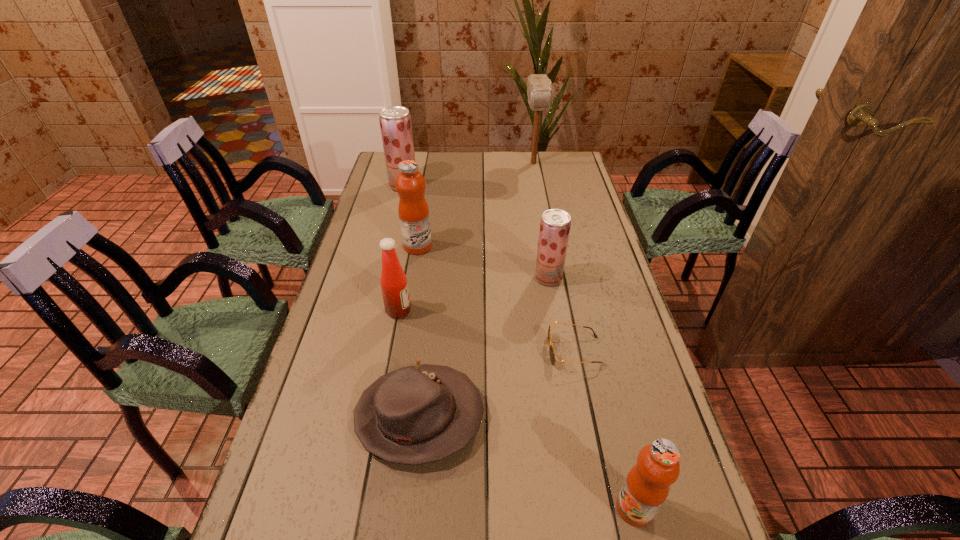
Identify the location of the rightmost fruit juice. Image resolution: width=960 pixels, height=540 pixels. (646, 487).

Where is `hat`? This screenshot has height=540, width=960. hat is located at coordinates (419, 414).

At what (x,y) coordinates should I click in order to perform the action: click on black sunglasses. Please return your answer as a coordinate pair (x, y). The height and width of the screenshot is (540, 960). Looking at the image, I should click on (551, 349).

Image resolution: width=960 pixels, height=540 pixels. What are the coordinates of `sunglasses` in the screenshot? It's located at (551, 349).

The image size is (960, 540). I want to click on vacant space located on the striking face of the farthest object, so click(540, 199).

The image size is (960, 540). Find the location of `free space located 0.330m on the front of the bigger strawberry fruit juice`. free space located 0.330m on the front of the bigger strawberry fruit juice is located at coordinates (389, 246).

Find the location of a particular element. This screenshot has height=540, width=960. vacant point located on the front label of the third farthest object is located at coordinates (490, 246).

At what (x,y) coordinates should I click in order to perform the action: click on blank area located on the front-facing side of the red condiment. Please return your answer as a coordinate pair (x, y). Looking at the image, I should click on (499, 310).

In order to click on free space located on the back of the fourth farthest object in this screenshot , I will do `click(537, 208)`.

Locate an element on the screen. The width and height of the screenshot is (960, 540). free space located 0.330m on the front label of the rightmost fruit juice is located at coordinates (446, 508).